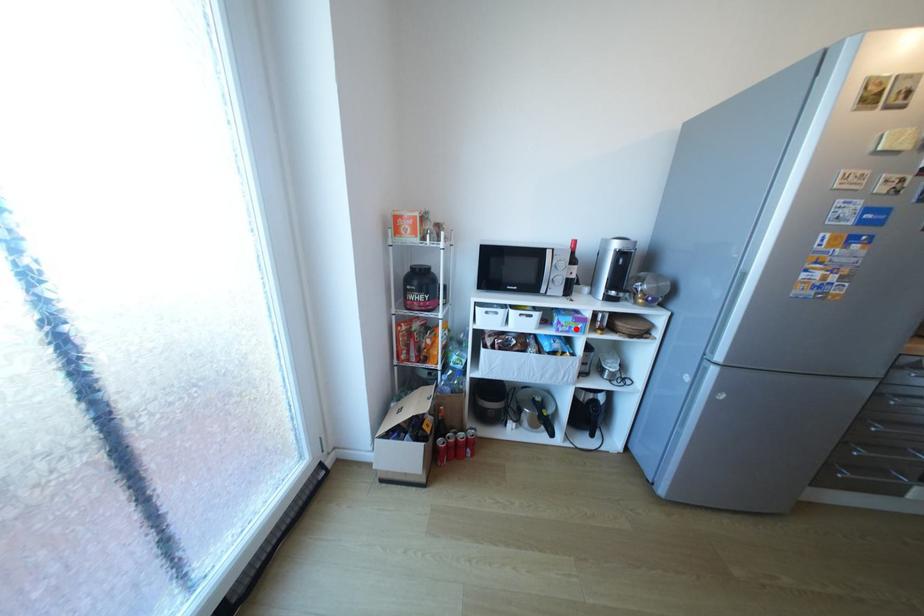
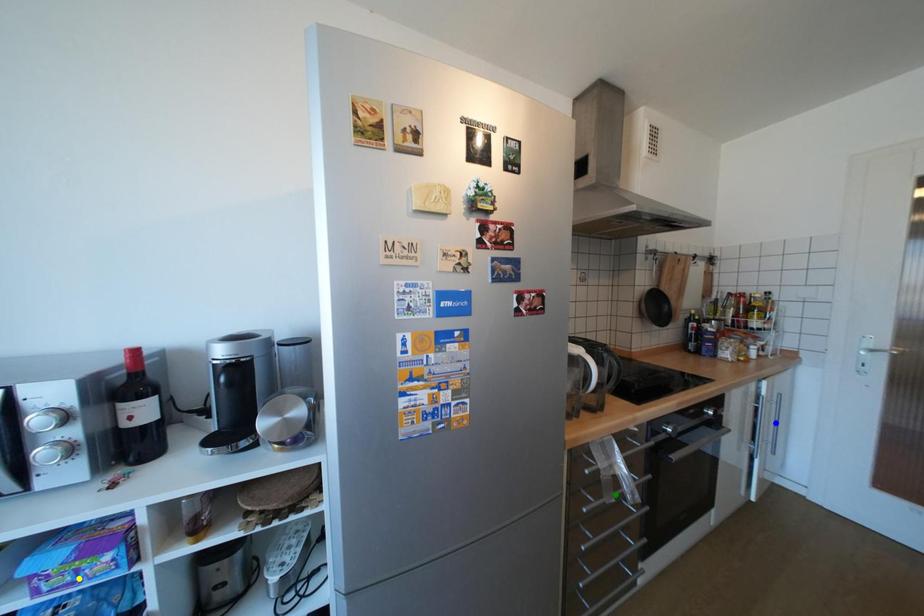
Question: I am providing you with two images of the same scene from different viewpoints. A red point is marked on the first image. You are given multiple points on the second image. In image 2, which mark is for the same physical point as the one in image 1?

Choices:
 (A) blue point
 (B) yellow point
 (C) green point

Answer: (B)